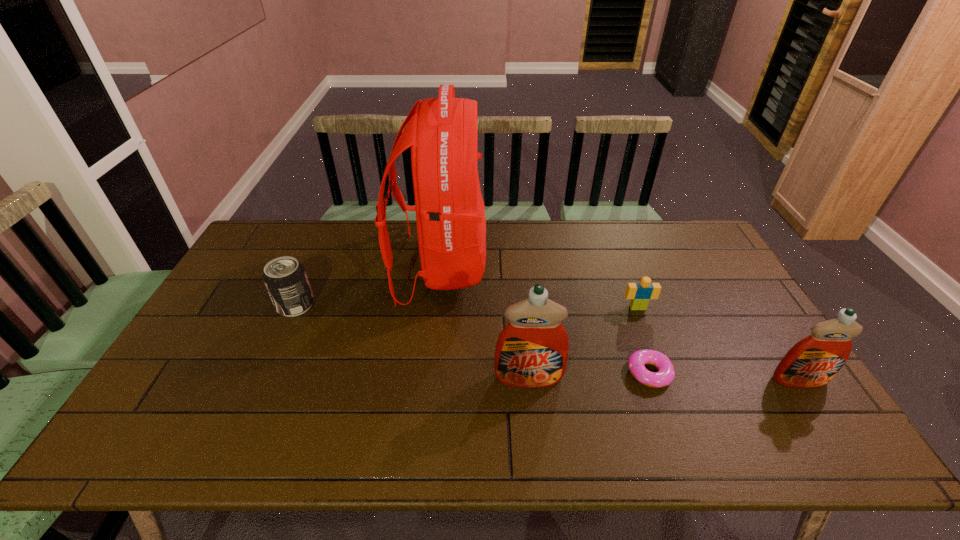
What are the coordinates of `the taller detergent` in the screenshot? It's located at (532, 350).

Find the location of a particular element. This screenshot has width=960, height=540. the left detergent is located at coordinates (532, 350).

What are the coordinates of `the fourth shortest object` in the screenshot? It's located at (812, 362).

This screenshot has height=540, width=960. Find the location of `the right detergent`. the right detergent is located at coordinates (812, 362).

Identify the location of backpack. (442, 132).

The image size is (960, 540). I want to click on the second object from left to right, so click(442, 132).

Where is `the fifth tallest object`? Image resolution: width=960 pixels, height=540 pixels. the fifth tallest object is located at coordinates (640, 293).

I want to click on the fourth tallest object, so click(285, 278).

You are a GUI agent. You are given a task and a screenshot of the screen. Output one action in this format:
    pyautogui.click(x=<x>, y=<y>)
    Task: Click on the soda can
    The width and height of the screenshot is (960, 540).
    Given the screenshot: What is the action you would take?
    pyautogui.click(x=285, y=278)

At what (x,y) coordinates should I click in order to perform the action: click on doughnut. Please return your answer as a coordinate pair (x, y). The height and width of the screenshot is (540, 960). Looking at the image, I should click on (638, 359).